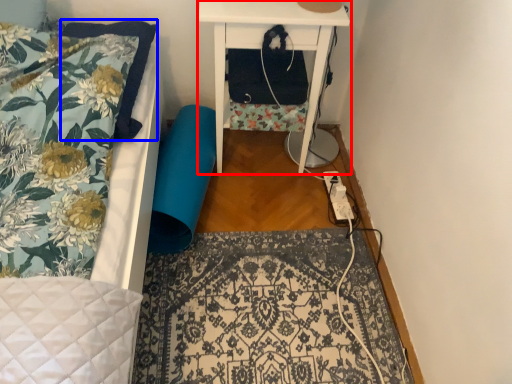
Question: Which point is further to the camera, nightstand (highlighted by a red box) or pillow (highlighted by a blue box)?

Choices:
 (A) nightstand
 (B) pillow

Answer: (A)